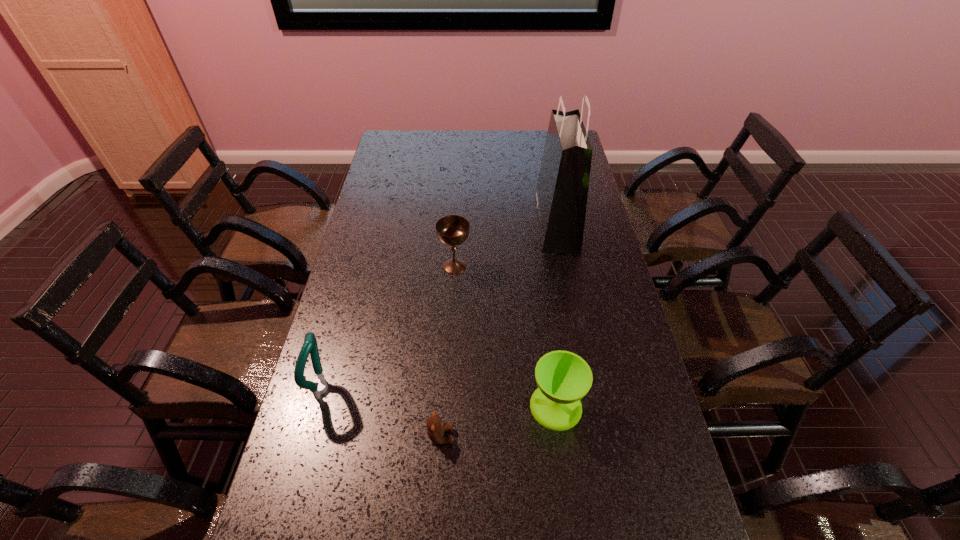
Point out which object is positioned as the second nearest to the teddy bear. Please provide its 2D coordinates. Your answer should be formatted as a tuple, i.e. [(x, y)], where the tuple contains the x and y coordinates of a point satisfying the conditions above.

[(319, 386)]

What are the coordinates of `the closest object to the fourth tallest object` in the screenshot? It's located at (435, 427).

Where is `free space that satisfies the following two spatial constraints: 1. at the jaws of the second shortest object; 2. on the right side of the bottle opener`? This screenshot has width=960, height=540. free space that satisfies the following two spatial constraints: 1. at the jaws of the second shortest object; 2. on the right side of the bottle opener is located at coordinates (319, 406).

This screenshot has width=960, height=540. In order to click on free location that satisfies the following two spatial constraints: 1. on the back side of the second shortest object; 2. at the jaws of the second tallest object in this screenshot , I will do point(554,388).